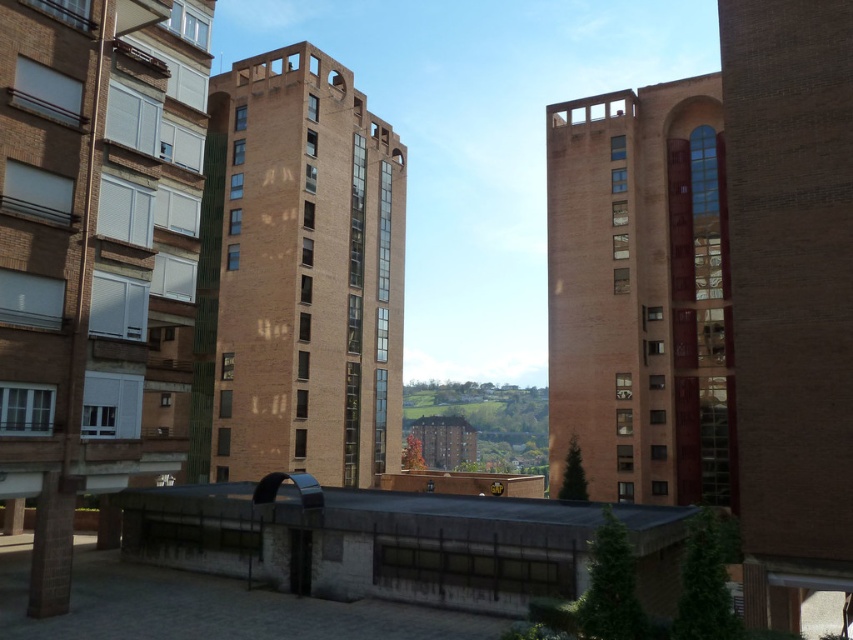
Does brown brick building at center have a greater height compared to brick tower at center?

Yes, brown brick building at center is taller than brick tower at center.

Image resolution: width=853 pixels, height=640 pixels. I want to click on brown brick building at center, so tap(297, 276).

Identify the location of brown brick building at center. This screenshot has width=853, height=640. (297, 276).